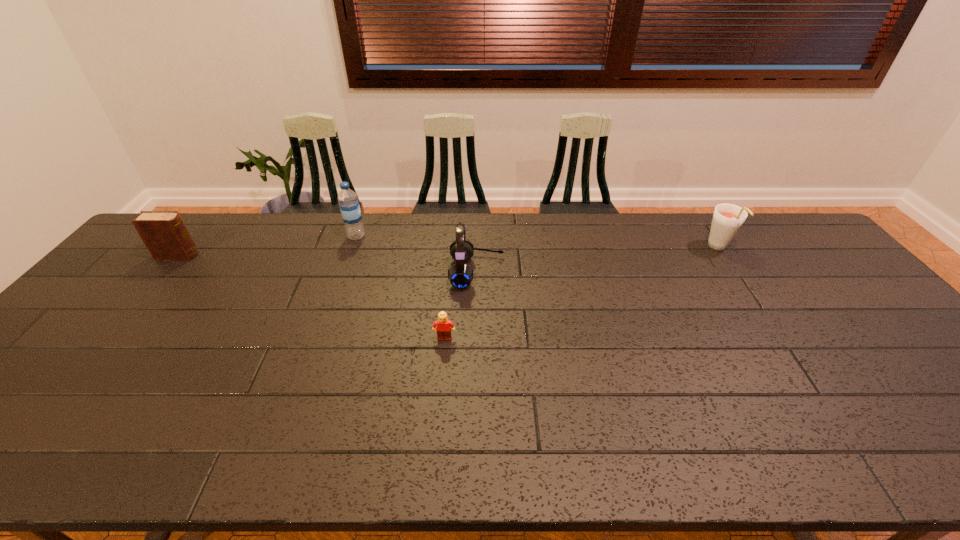
Identify the location of vacant space located 0.110m on the spine side of the leftmost object. The height and width of the screenshot is (540, 960). (232, 255).

Locate an element on the screen. Image resolution: width=960 pixels, height=540 pixels. vacant space located 0.080m on the face of the shortest object is located at coordinates (442, 367).

The image size is (960, 540). I want to click on water bottle that is at the far edge, so click(349, 205).

The width and height of the screenshot is (960, 540). I want to click on root beer present at the far edge, so click(x=727, y=219).

This screenshot has width=960, height=540. I want to click on headset situated at the far edge, so click(460, 275).

The height and width of the screenshot is (540, 960). I want to click on diary that is at the far edge, so click(x=164, y=233).

Image resolution: width=960 pixels, height=540 pixels. What are the coordinates of `object situated at the left edge` in the screenshot? It's located at (164, 233).

You are a GUI agent. You are given a task and a screenshot of the screen. Output one action in this format:
    pyautogui.click(x=<x>, y=<y>)
    Task: Click on the object positioned at the far left corner
    This screenshot has height=540, width=960.
    Given the screenshot: What is the action you would take?
    pyautogui.click(x=164, y=233)

Locate an element on the screen. Image resolution: width=960 pixels, height=540 pixels. free space at the far edge of the desktop is located at coordinates (417, 235).

The width and height of the screenshot is (960, 540). In order to click on blank space at the near edge of the desktop in this screenshot , I will do `click(733, 454)`.